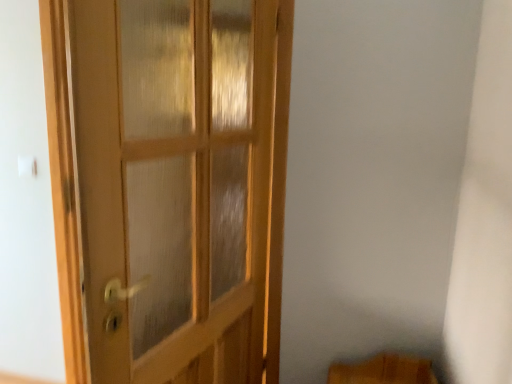
What are the coordinates of `light wood door at left` in the screenshot? It's located at (173, 187).

Describe the element at coordinates (173, 187) in the screenshot. I see `light wood door at left` at that location.

Consider the image. Measure the distance between point [99,112] and camera.

Point [99,112] is 90.90 centimeters away from camera.

This screenshot has width=512, height=384. What are the coordinates of `light wood door at left` in the screenshot? It's located at (173, 187).